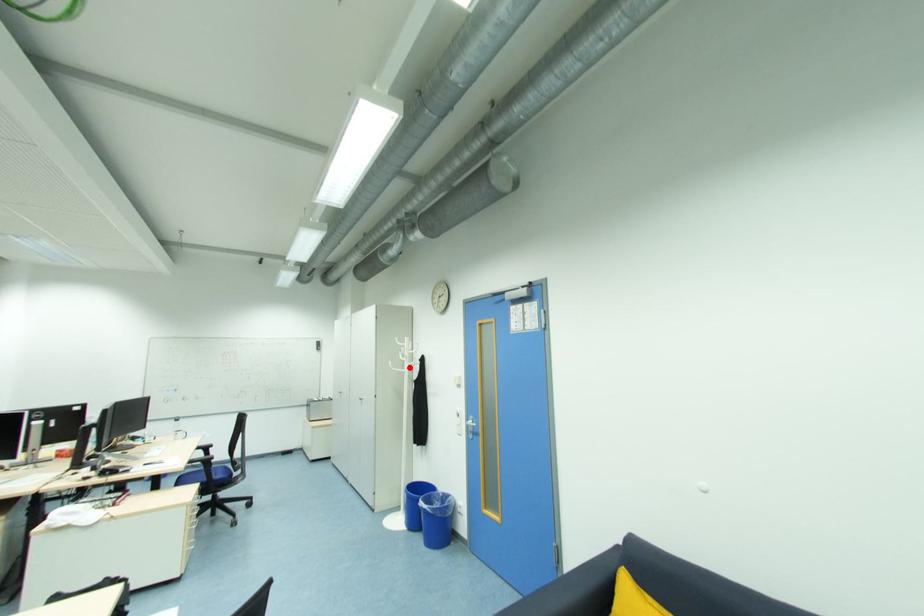
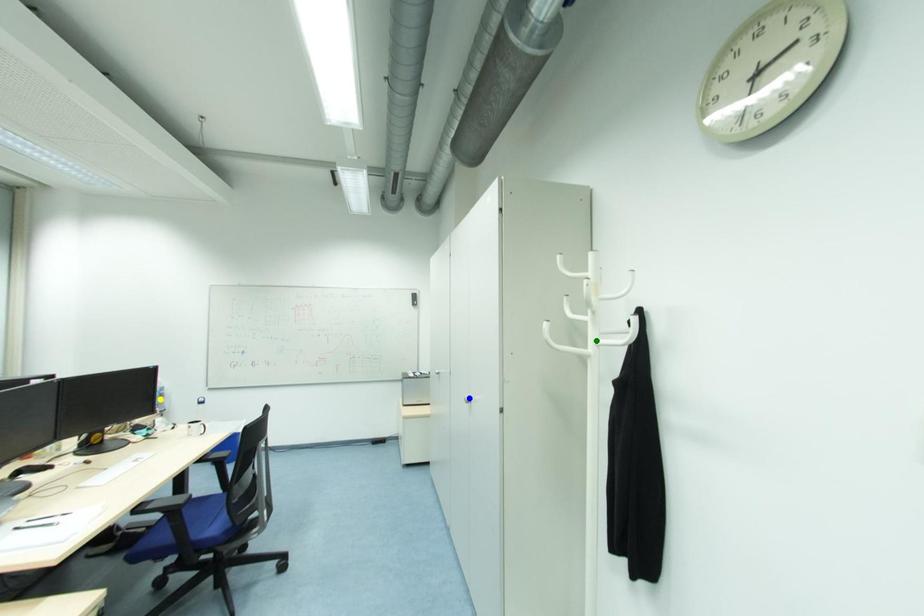
Question: I am providing you with two images of the same scene from different viewpoints. A red point is marked on the first image. You are given multiple points on the second image. Which point in image 2 is actually the same real-world point as the red point in image 1?

Choices:
 (A) blue point
 (B) green point
 (C) yellow point

Answer: (B)